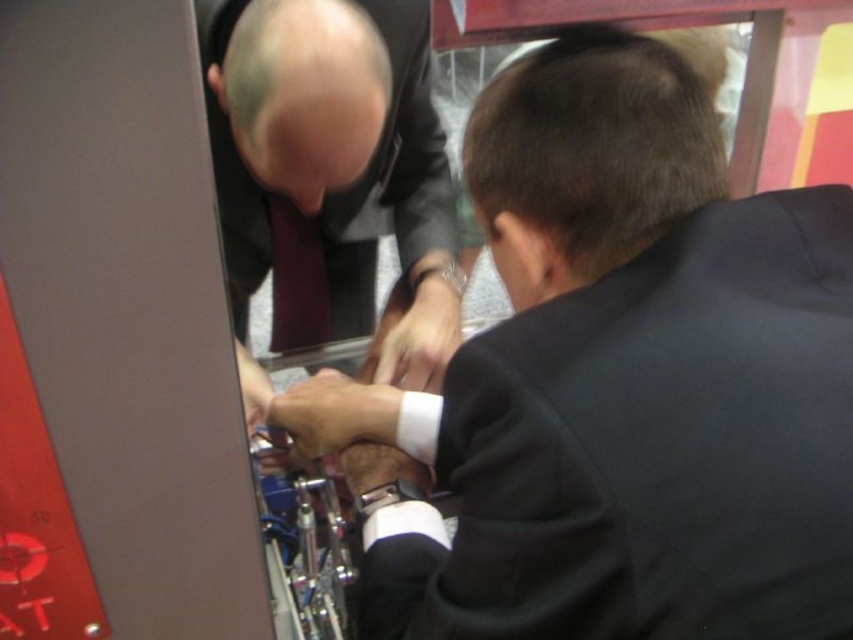
You are a photographer standing at a distance of 30 inches from the shiny black suit at center. Can you take a clear photo of it without moving closer?

The shiny black suit at center is 26.68 inches from viewer. Since you are standing 30 inches away, you are slightly farther than the object, so you can still take a clear photo without moving closer as the distance is only 3.32 inches more.